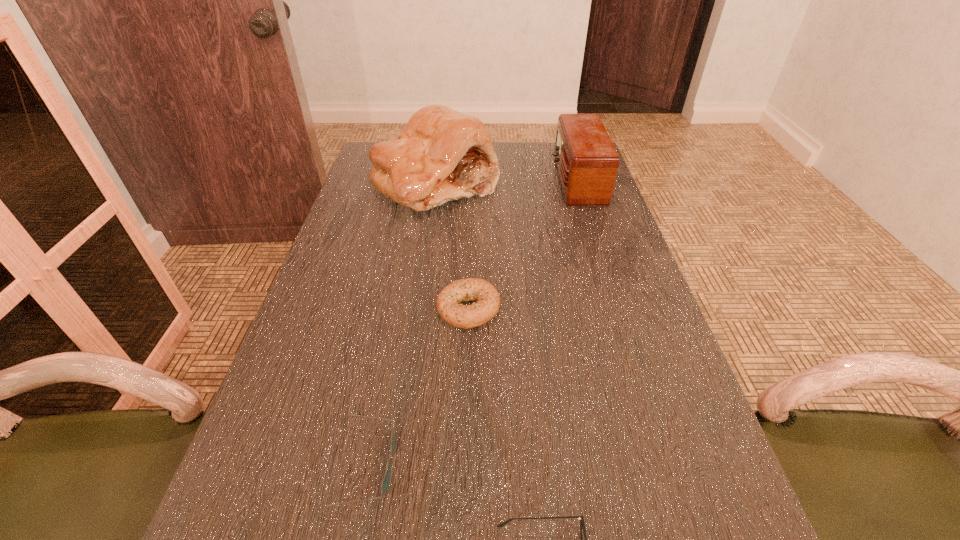
Where is `vacant point that satisfies the following two spatial constraints: 1. on the filling side of the tallest object; 2. on the right side of the third nearest object`? Image resolution: width=960 pixels, height=540 pixels. vacant point that satisfies the following two spatial constraints: 1. on the filling side of the tallest object; 2. on the right side of the third nearest object is located at coordinates (418, 308).

Where is `free location that satisfies the following two spatial constraints: 1. on the front-facing side of the fourth shortest object; 2. on the filling side of the tallest object`? This screenshot has width=960, height=540. free location that satisfies the following two spatial constraints: 1. on the front-facing side of the fourth shortest object; 2. on the filling side of the tallest object is located at coordinates (578, 184).